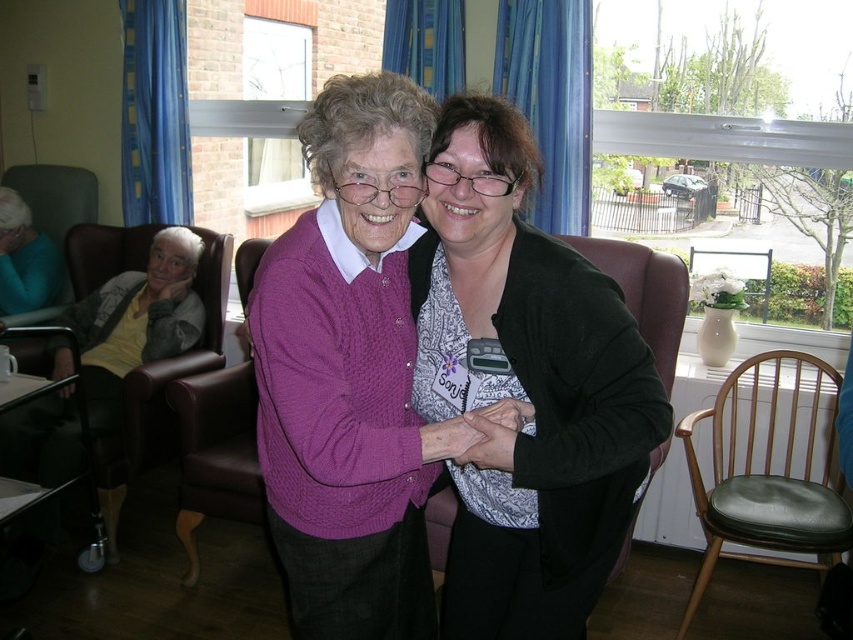
Can you confirm if green leather armchair at lower right is thinner than matte yellow sweater at left?

In fact, green leather armchair at lower right might be wider than matte yellow sweater at left.

Is point (816, 410) farther from camera compared to point (105, 342)?

No, it is in front of (105, 342).

Identify the location of green leather armchair at lower right. (769, 470).

Does matte purple sweater at center have a lesser width compared to green leather armchair at lower right?

Correct, matte purple sweater at center's width is less than green leather armchair at lower right's.

Where is `matte purple sweater at center`? Image resolution: width=853 pixels, height=640 pixels. matte purple sweater at center is located at coordinates (524, 387).

The width and height of the screenshot is (853, 640). Find the location of `matte purple sweater at center`. matte purple sweater at center is located at coordinates (524, 387).

Which is below, matte purple sweater at center or matte yellow sweater at left?

matte purple sweater at center

Is matte purple sweater at center smaller than matte yellow sweater at left?

Indeed, matte purple sweater at center has a smaller size compared to matte yellow sweater at left.

Between point (589, 403) and point (190, 330), which one is positioned in front?

Point (589, 403)

Where is `matte purple sweater at center`? The width and height of the screenshot is (853, 640). matte purple sweater at center is located at coordinates (524, 387).